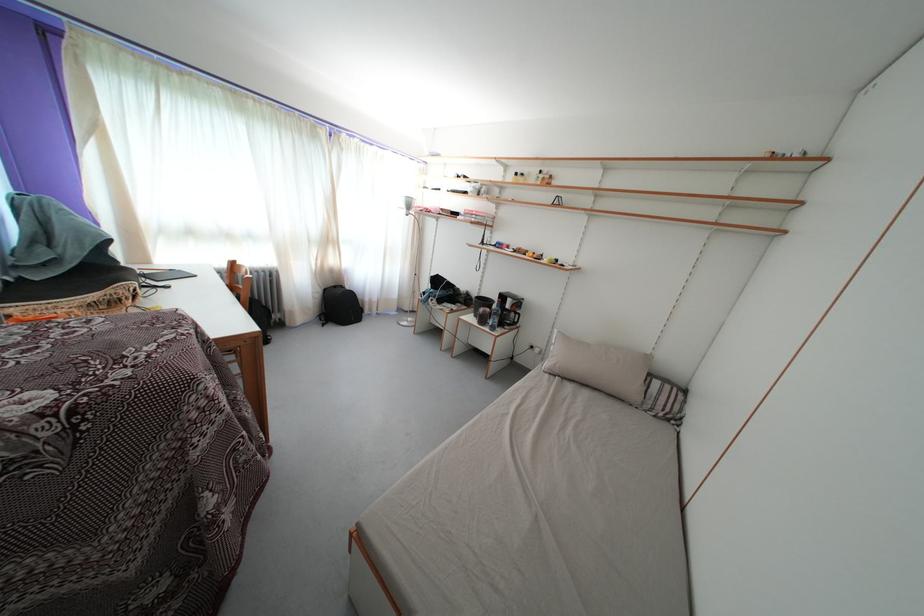
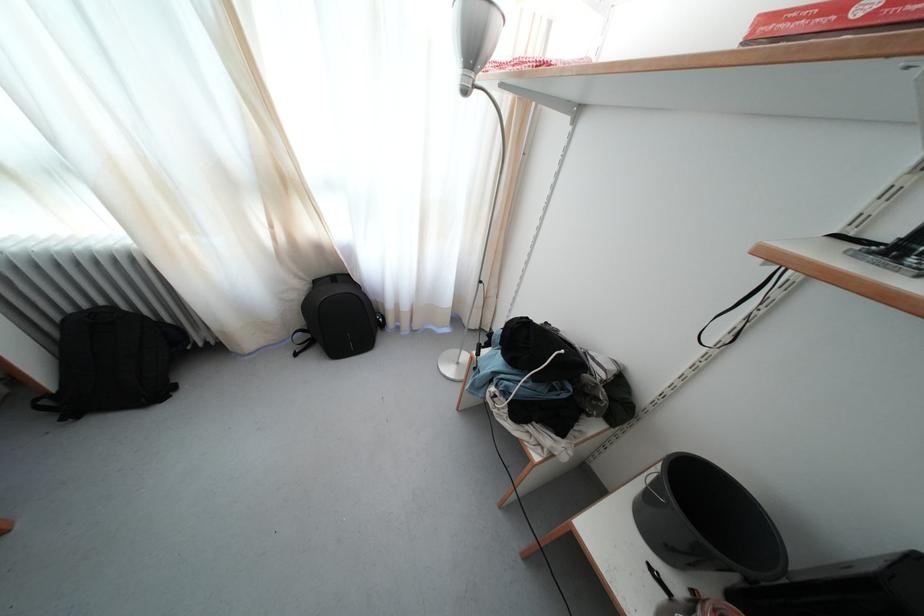
Question: The images are taken continuously from a first-person perspective. In which direction are you moving?

Choices:
 (A) Left
 (B) Right
 (C) Forward
 (D) Backward

Answer: (C)